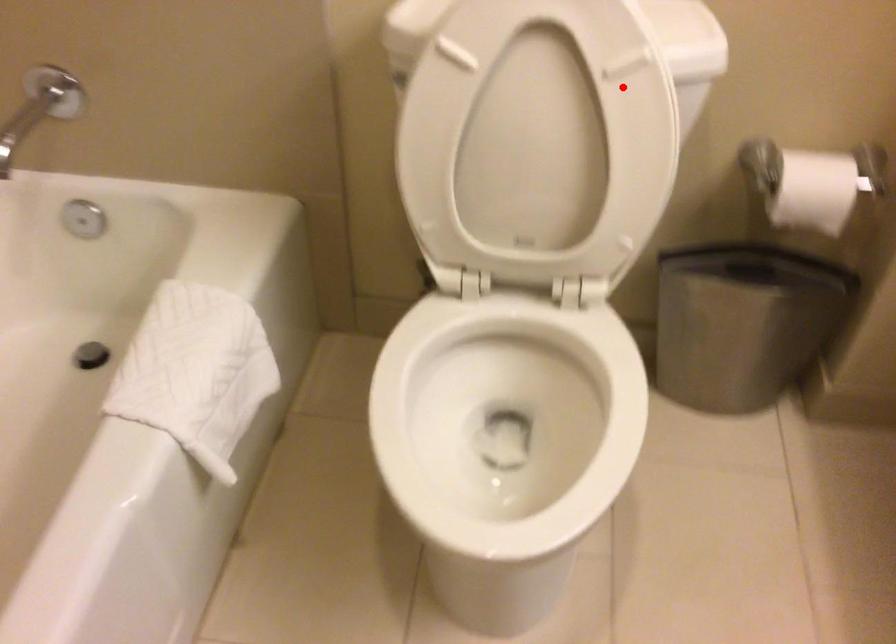
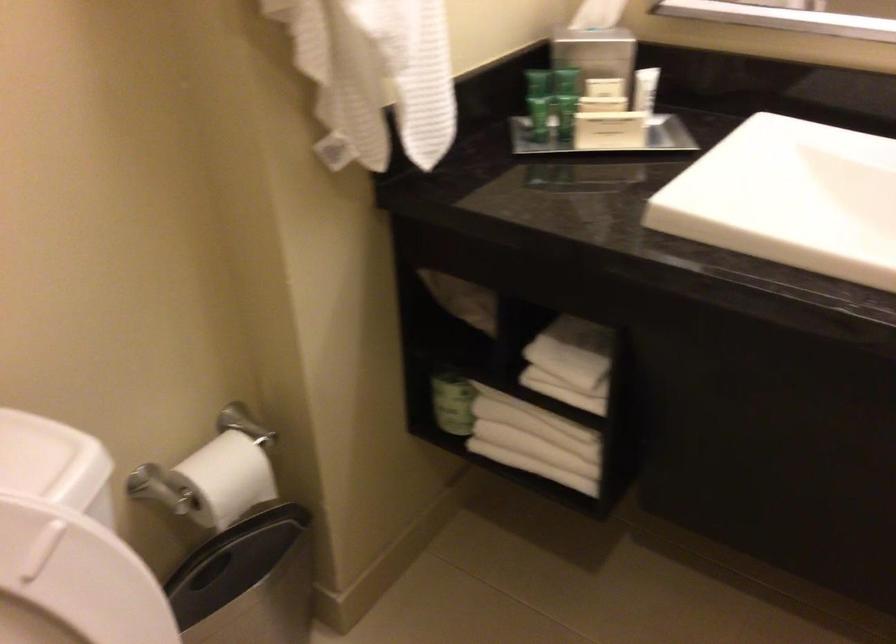
Question: I am providing you with two images of the same scene from different viewpoints. Image1 has a red point marked. In image2, the corresponding 3D location appears at what relative position? Reply with the corresponding letter.

Choices:
 (A) Closer
 (B) Farther

Answer: (A)